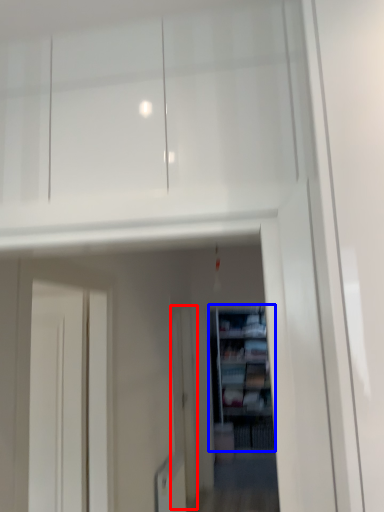
Question: Which of the following is the farthest to the observer, screen door (highlighted by a red box) or shelf (highlighted by a blue box)?

Choices:
 (A) screen door
 (B) shelf

Answer: (B)